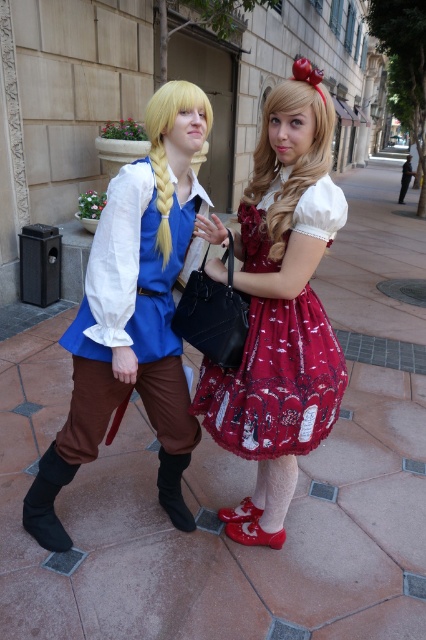
You are a photographer setting up a shoot in the scene. You need to position a spotlight so it can illuminate both the matte blue shirt at center and the black leather boot at lower left. Since the spotlight can only be placed at the same height as one of the objects, which object should you align the spotlight with to ensure both are properly lit?

The spotlight should be aligned with the height of the matte blue shirt at center because it is taller than the black leather boot at lower left. This way, the light will cover both objects effectively.

You are a photographer setting up a shoot in the scene described. You need to position a light source so that it illuminates both the velvet red dress at center and the black suede boot at lower center without casting shadows on the background. Given their relative heights, where should you place the light source in relation to them?

The velvet red dress at center is taller than the black suede boot at lower center. To avoid casting shadows on the background, the light source should be placed above and slightly behind both objects, ensuring that the taller velvet red dress doesn not block the light reaching the shorter boot.

You are a photographer setting up a camera on the ground between the two people. The camera is 18 inches wide. Can you position the camera so that it fits entirely between the black leather boot at lower left and the black suede boot at lower center without touching either boot?

The distance between the black leather boot at lower left and the black suede boot at lower center is 21.24 inches. Since the camera is 18 inches wide, there is enough space to position it between the two boots without touching either one.